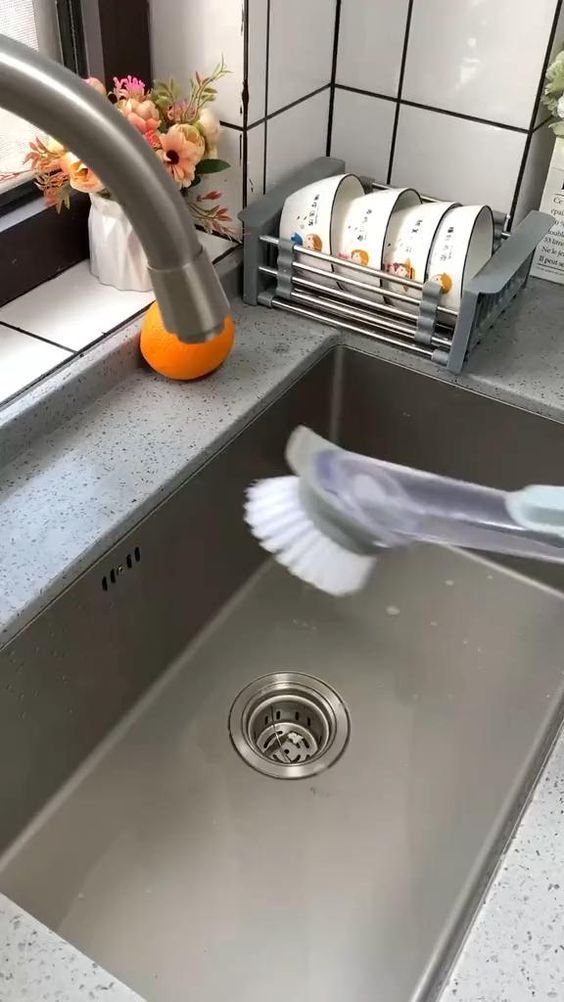
Find the location of a particular element. This screenshot has height=1002, width=564. scrub brush is located at coordinates (289, 539).